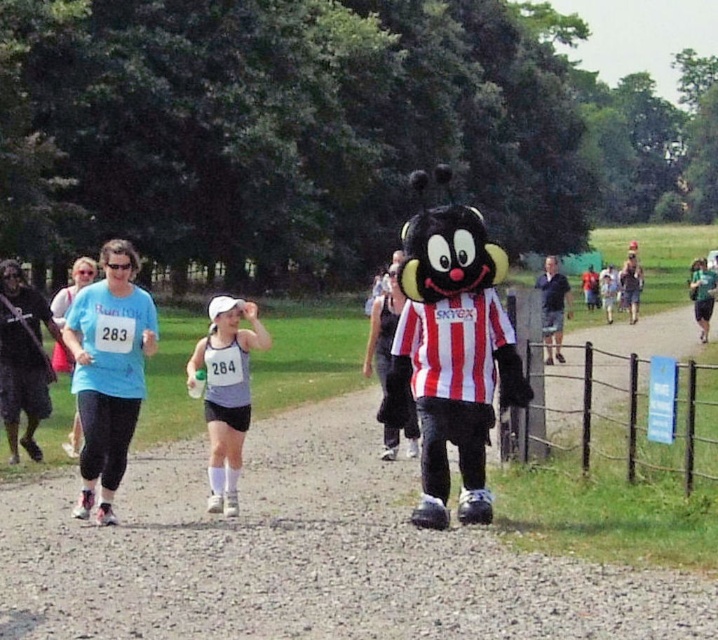
You are a participant in the race and currently at the position of point (102,360). You need to reach the finish line located at point (220,333). Is the finish line ahead of you or behind you?

The finish line at point (220,333) is behind you because point (102,360) is in front of it.